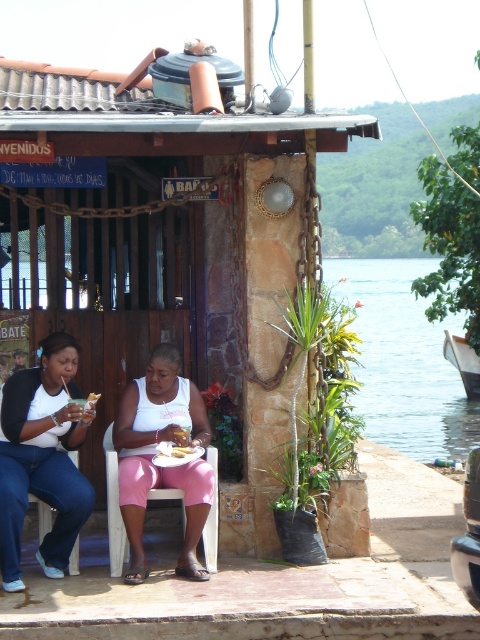
Question: Which point is farther to the camera?

Choices:
 (A) stone textured hut at center
 (B) smooth concrete porch at center
 (C) transparent water at lower center
 (D) pink fabric shorts at center

Answer: (C)

Question: Does denim pants at lower left have a lesser width compared to golden brown bread at center?

Choices:
 (A) no
 (B) yes

Answer: (A)

Question: Which object appears farthest from the camera in this image?

Choices:
 (A) golden brown bread at center
 (B) transparent water at lower center
 (C) pink fabric shorts at center

Answer: (B)

Question: Can you confirm if pink fabric shorts at center is positioned above golden brown bread at center?

Choices:
 (A) no
 (B) yes

Answer: (A)

Question: Which of the following is the closest to the observer?

Choices:
 (A) white paper plate at center
 (B) pink fabric skirt at center
 (C) golden brown bread at center

Answer: (B)

Question: Is stone textured hut at center bigger than pink fabric skirt at center?

Choices:
 (A) no
 (B) yes

Answer: (B)